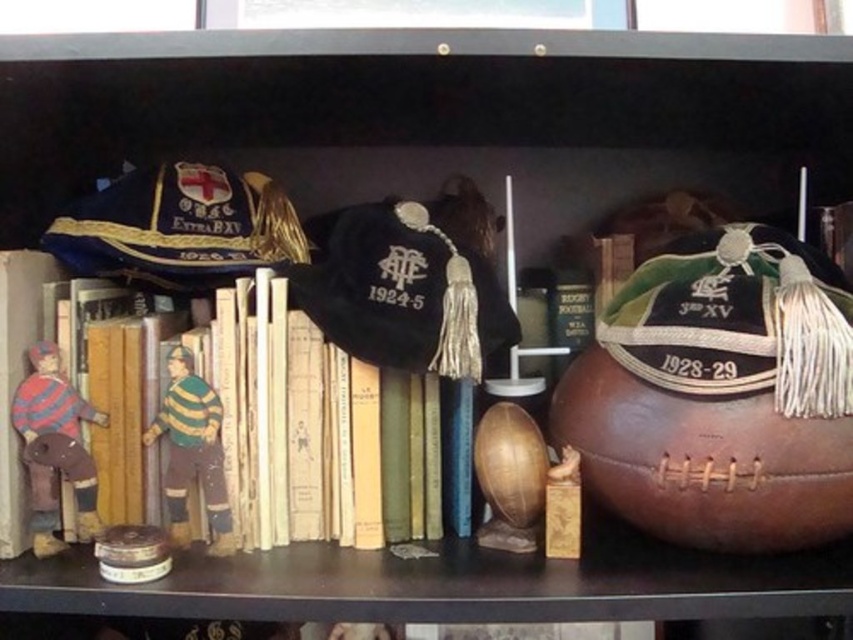
Question: Which point is farther from the camera taking this photo?

Choices:
 (A) (792, 307)
 (B) (166, 502)
 (C) (260, 333)

Answer: (B)

Question: Which object appears farthest from the camera in this image?

Choices:
 (A) black velvet cap at center
 (B) yellow paper book at center
 (C) velvet green cap at right
 (D) blue velvet cap at upper left

Answer: (D)

Question: Can you confirm if yellow paper book at center is thinner than blue velvet cap at upper left?

Choices:
 (A) yes
 (B) no

Answer: (B)

Question: Where is velvet green cap at right located in relation to black velvet cap at center in the image?

Choices:
 (A) below
 (B) above

Answer: (A)

Question: Is black velvet cap at center thinner than striped fabric figure at left?

Choices:
 (A) yes
 (B) no

Answer: (B)

Question: Based on their relative distances, which object is nearer to the striped fabric figure at left?

Choices:
 (A) blue velvet cap at upper left
 (B) wooden painted figure at center

Answer: (B)